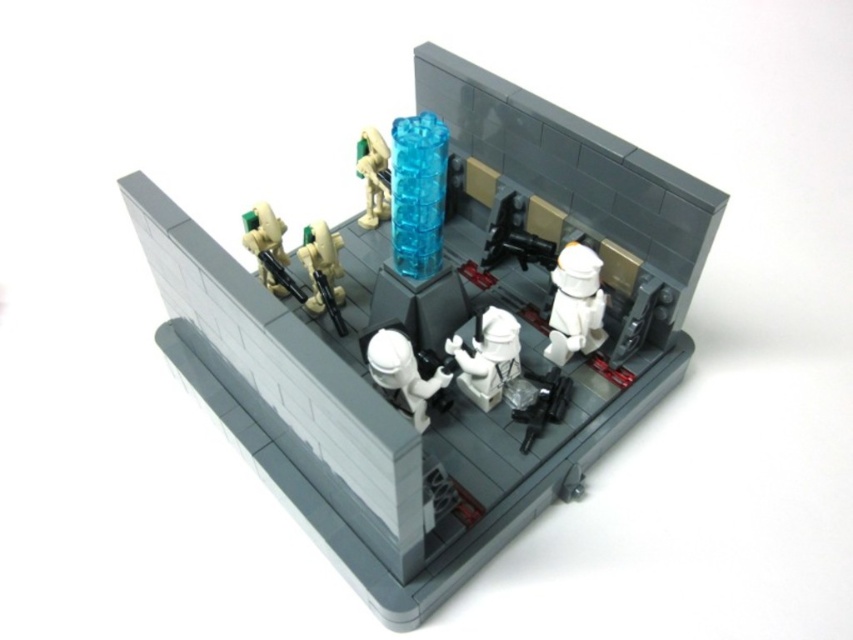
Is the position of translucent blue plastic column at center more distant than that of white matte stormtrooper helmet at center?

No, translucent blue plastic column at center is closer to the viewer.

Is translucent blue plastic column at center bigger than white matte stormtrooper helmet at center?

Yes, translucent blue plastic column at center is bigger than white matte stormtrooper helmet at center.

Does point (260, 298) come behind point (407, 397)?

No, it is in front of (407, 397).

You are a GUI agent. You are given a task and a screenshot of the screen. Output one action in this format:
    pyautogui.click(x=<x>, y=<y>)
    Task: Click on the translucent blue plastic column at center
    
    Given the screenshot: What is the action you would take?
    pyautogui.click(x=439, y=339)

Which is more to the left, translucent blue plastic column at center or white matte figure at center?

translucent blue plastic column at center

From the picture: Who is taller, translucent blue plastic column at center or white matte figure at center?

Standing taller between the two is translucent blue plastic column at center.

This screenshot has height=640, width=853. Find the location of `translucent blue plastic column at center`. translucent blue plastic column at center is located at coordinates (439, 339).

Is white matte figure at center shorter than translucent blue tower at center?

Indeed, white matte figure at center has a lesser height compared to translucent blue tower at center.

Where is `white matte figure at center`? This screenshot has width=853, height=640. white matte figure at center is located at coordinates (486, 356).

Where is `white matte figure at center`? This screenshot has height=640, width=853. white matte figure at center is located at coordinates (486, 356).